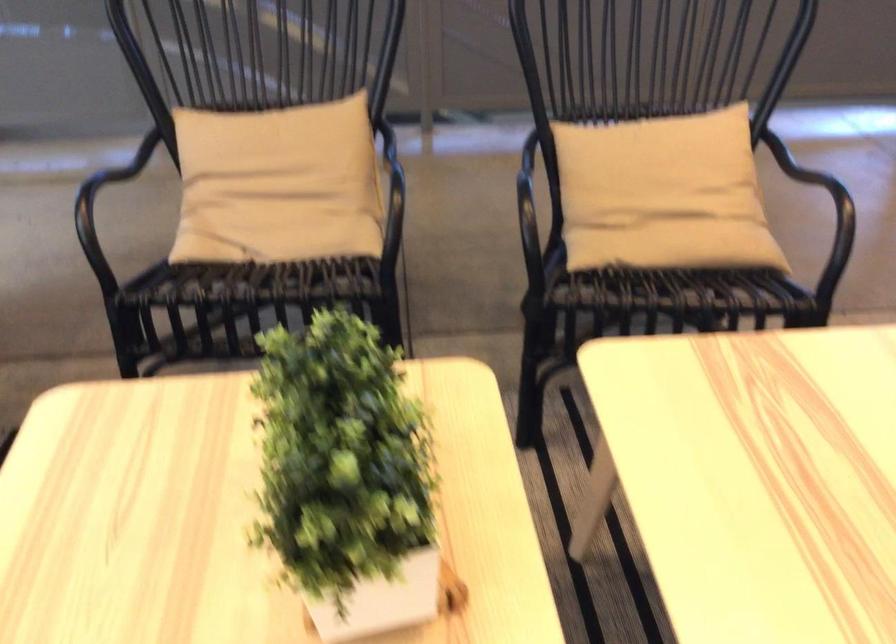
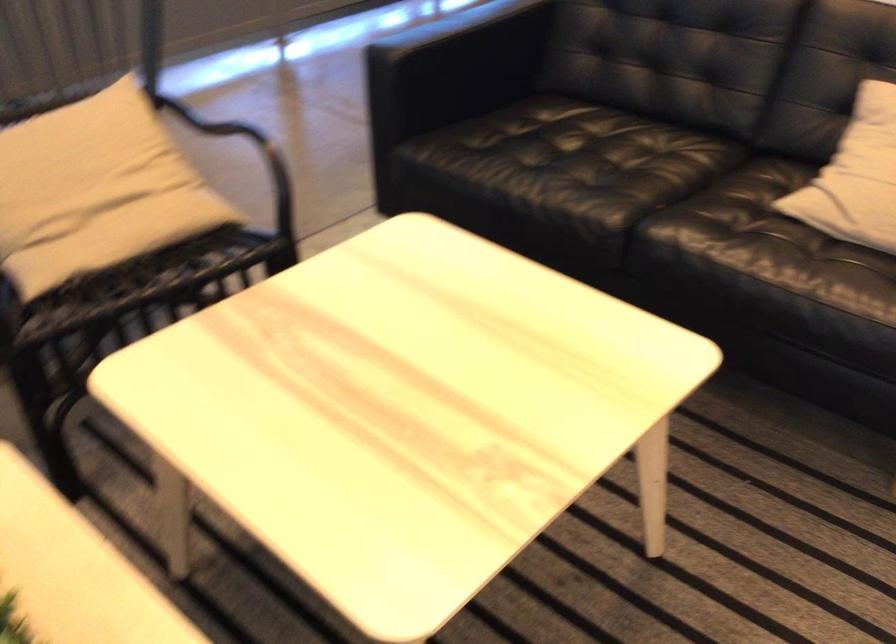
Question: The camera is either moving clockwise (left) or counter-clockwise (right) around the object. The first image is from the beginning of the video and the second image is from the end. Is the camera moving left or right when shooting the video?

Choices:
 (A) Left
 (B) Right

Answer: (A)